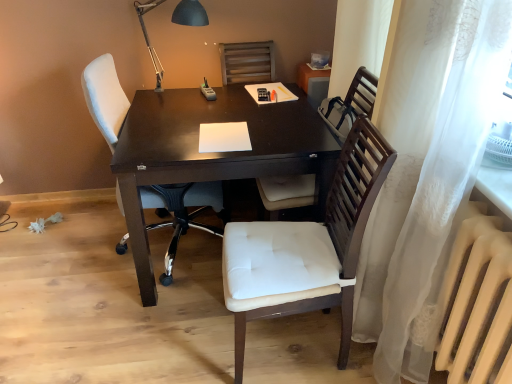
Find the location of a particular element. The image size is (512, 384). vacant space that is to the left of white paper at center is located at coordinates (172, 134).